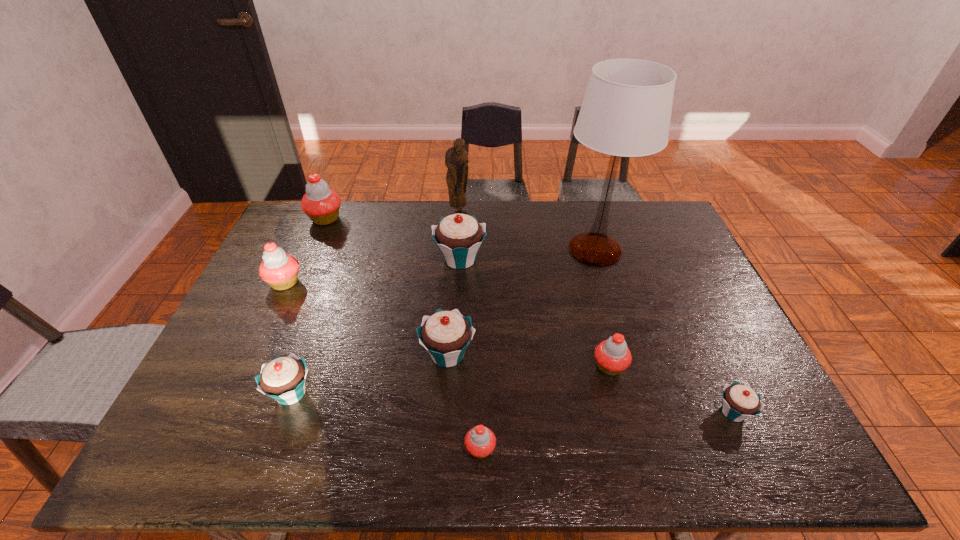
Where is `red cupcake that is the nearest to the nearest cupcake`? The image size is (960, 540). red cupcake that is the nearest to the nearest cupcake is located at coordinates (613, 356).

The image size is (960, 540). What are the coordinates of `free spot that satisfies the following two spatial constraints: 1. above the cylindrical shade of the rightmost teal cupcake; 2. on the right side of the tallest object` in the screenshot? It's located at (643, 412).